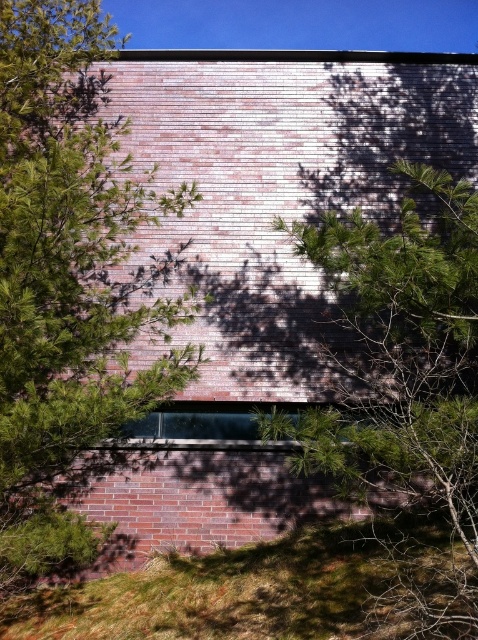
Question: Among these objects, which one is farthest from the camera?

Choices:
 (A) green leafy tree at center
 (B) green grass at lower center

Answer: (B)

Question: Is green leafy tree at left behind green leafy tree at center?

Choices:
 (A) yes
 (B) no

Answer: (A)

Question: Can you confirm if green leafy tree at left is wider than green leafy tree at center?

Choices:
 (A) yes
 (B) no

Answer: (B)

Question: Is green leafy tree at center to the right of green grass at lower center from the viewer's perspective?

Choices:
 (A) no
 (B) yes

Answer: (B)

Question: Among these objects, which one is farthest from the camera?

Choices:
 (A) green leafy tree at center
 (B) green grass at lower center

Answer: (B)

Question: Which of the following is the closest to the observer?

Choices:
 (A) (12, 154)
 (B) (138, 636)
 (C) (395, 547)

Answer: (B)